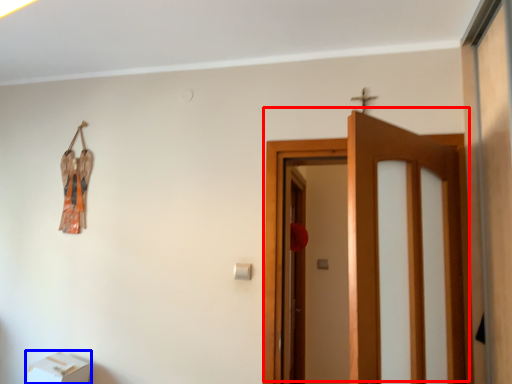
Question: Among these objects, which one is farthest to the camera, door (highlighted by a red box) or furniture (highlighted by a blue box)?

Choices:
 (A) door
 (B) furniture

Answer: (B)